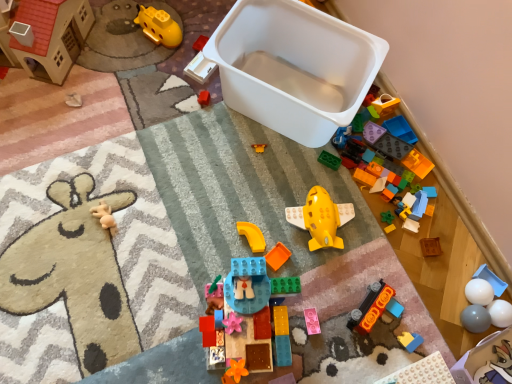
What is the approximate width of white plastic storage box at upper center, the 2th storage box in the right-to-left sequence?

The width of white plastic storage box at upper center, the 2th storage box in the right-to-left sequence, is 31.25 centimeters.

I want to click on white plastic storage box at upper center, the 1th storage box when ordered from left to right, so click(294, 66).

In order to face matte green block at center, the 6th toy in the right-to-left sequence, should I rotate leftwards or rightwards?

It's best to rotate right around 17.815 degrees.

This screenshot has width=512, height=384. What do you see at coordinates (159, 26) in the screenshot? I see `yellow plastic submarine at upper left, which appears as the third toy when viewed from the left` at bounding box center [159, 26].

What do you see at coordinates (104, 216) in the screenshot? This screenshot has width=512, height=384. I see `beige rubber bear at left, which ranks as the 15th toy in right-to-left order` at bounding box center [104, 216].

Describe the element at coordinates (200, 68) in the screenshot. Image resolution: width=512 pixels, height=384 pixels. I see `white plastic tray at upper center, placed as the 13th toy when sorted from right to left` at that location.

This screenshot has width=512, height=384. Describe the element at coordinates (243, 337) in the screenshot. I see `translucent blue plastic building block at center, the 12th toy from the right` at that location.

Find the location of `white plastic storage box at upper center, marked as the second storage box in a bottom-to-top arrangement`. white plastic storage box at upper center, marked as the second storage box in a bottom-to-top arrangement is located at coordinates (294, 66).

Which object is further away from the camera taking this photo, cardboard house at upper left, the 1th toy positioned from the left, or white plastic storage box at upper center, the 2th storage box in the right-to-left sequence?

Positioned behind is white plastic storage box at upper center, the 2th storage box in the right-to-left sequence.

Which toy is the 6th one when counting from the left side of the white plastic storage box at upper center, marked as the second storage box in a bottom-to-top arrangement? Please provide its 2D coordinates.

[(52, 36)]

Is cardboard house at upper left, which is the sixteenth toy in right-to-left order, facing away from white plastic storage box at upper center, which appears as the first storage box when viewed from the top?

No, cardboard house at upper left, which is the sixteenth toy in right-to-left order, is not facing away from white plastic storage box at upper center, which appears as the first storage box when viewed from the top.

Which point is more forward, (81, 38) or (249, 77)?

Positioned in front is point (249, 77).

Is orange matte car at lower right, the 8th toy in the right-to-left sequence, situated inside beige rubber bear at left, placed as the 2th toy when sorted from left to right, or outside?

orange matte car at lower right, the 8th toy in the right-to-left sequence, is spatially situated outside beige rubber bear at left, placed as the 2th toy when sorted from left to right.

Is orange matte car at lower right, marked as the 9th toy in a left-to-right arrangement, further to the viewer compared to beige rubber bear at left, which ranks as the 15th toy in right-to-left order?

No, it is in front of beige rubber bear at left, which ranks as the 15th toy in right-to-left order.

Considering the relative sizes of orange matte car at lower right, marked as the 9th toy in a left-to-right arrangement, and beige rubber bear at left, placed as the 2th toy when sorted from left to right, in the image provided, is orange matte car at lower right, marked as the 9th toy in a left-to-right arrangement, smaller than beige rubber bear at left, placed as the 2th toy when sorted from left to right,?

No, orange matte car at lower right, marked as the 9th toy in a left-to-right arrangement, is not smaller than beige rubber bear at left, placed as the 2th toy when sorted from left to right.

From the image's perspective, is orange matte car at lower right, the 8th toy in the right-to-left sequence, over beige rubber bear at left, placed as the 2th toy when sorted from left to right?

No, from the image's perspective, orange matte car at lower right, the 8th toy in the right-to-left sequence, is not above beige rubber bear at left, placed as the 2th toy when sorted from left to right.

From the image's perspective, is pearl white plastic plate at lower right, arranged as the fourth toy when viewed from the right, located above yellow plastic submarine at upper left, which ranks as the fourteenth toy in right-to-left order?

Actually, pearl white plastic plate at lower right, arranged as the fourth toy when viewed from the right, appears below yellow plastic submarine at upper left, which ranks as the fourteenth toy in right-to-left order, in the image.

Measure the distance between pearl white plastic plate at lower right, arranged as the fourth toy when viewed from the right, and yellow plastic submarine at upper left, which appears as the third toy when viewed from the left.

pearl white plastic plate at lower right, arranged as the fourth toy when viewed from the right, is 1.17 meters away from yellow plastic submarine at upper left, which appears as the third toy when viewed from the left.

Which of these two, pearl white plastic plate at lower right, which is counted as the 13th toy, starting from the left, or yellow plastic submarine at upper left, which appears as the third toy when viewed from the left, is bigger?

With larger size is pearl white plastic plate at lower right, which is counted as the 13th toy, starting from the left.

In the scene shown: Which of these two, orange matte car at lower right, the 8th toy in the right-to-left sequence, or white glossy ball at lower right, the fifteenth toy in the left-to-right sequence, is smaller?

white glossy ball at lower right, the fifteenth toy in the left-to-right sequence.

Is orange matte car at lower right, marked as the 9th toy in a left-to-right arrangement, located outside white glossy ball at lower right, the fifteenth toy in the left-to-right sequence?

Indeed, orange matte car at lower right, marked as the 9th toy in a left-to-right arrangement, is completely outside white glossy ball at lower right, the fifteenth toy in the left-to-right sequence.

What's the angular difference between orange matte car at lower right, marked as the 9th toy in a left-to-right arrangement, and white glossy ball at lower right, which ranks as the second toy in right-to-left order,'s facing directions?

There is a 24.2-degree angle between the facing directions of orange matte car at lower right, marked as the 9th toy in a left-to-right arrangement, and white glossy ball at lower right, which ranks as the second toy in right-to-left order.

Is orange matte car at lower right, the 8th toy in the right-to-left sequence, far from white glossy ball at lower right, which ranks as the second toy in right-to-left order?

orange matte car at lower right, the 8th toy in the right-to-left sequence, is near white glossy ball at lower right, which ranks as the second toy in right-to-left order, not far away.

From a real-world perspective, who is located higher, beige rubber bear at left, placed as the 2th toy when sorted from left to right, or white plastic tray at upper center, placed as the 13th toy when sorted from right to left?

From a 3D spatial view, beige rubber bear at left, placed as the 2th toy when sorted from left to right, is above.

Looking at this image, is beige rubber bear at left, placed as the 2th toy when sorted from left to right, located outside white plastic tray at upper center, acting as the fourth toy starting from the left?

Yes, beige rubber bear at left, placed as the 2th toy when sorted from left to right, is located beyond the bounds of white plastic tray at upper center, acting as the fourth toy starting from the left.

In the scene shown: Is beige rubber bear at left, which ranks as the 15th toy in right-to-left order, facing away from white plastic tray at upper center, placed as the 13th toy when sorted from right to left?

Yes.

Identify the location of the 7th toy in front of the white plastic tray at upper center, acting as the fourth toy starting from the left, counting from the anchor's position. (104, 216).

Between point (482, 314) and point (412, 333), which one is positioned in front?

Point (482, 314)

Does white glossy ball at lower right, acting as the 1th toy starting from the right, have a smaller size compared to matte plastic toy at lower right, which is counted as the 12th toy, starting from the left?

No.

Would you consider white glossy ball at lower right, acting as the 1th toy starting from the right, to be distant from matte plastic toy at lower right, which is counted as the 12th toy, starting from the left?

white glossy ball at lower right, acting as the 1th toy starting from the right, is actually quite close to matte plastic toy at lower right, which is counted as the 12th toy, starting from the left.

Considering the positions of objects white glossy ball at lower right, acting as the 16th toy starting from the left, and matte plastic toy at lower right, the 5th toy viewed from the right, in the image provided, who is more to the left, white glossy ball at lower right, acting as the 16th toy starting from the left, or matte plastic toy at lower right, the 5th toy viewed from the right,?

From the viewer's perspective, matte plastic toy at lower right, the 5th toy viewed from the right, appears more on the left side.

From the image's perspective, is beige rubber bear at left, which ranks as the 15th toy in right-to-left order, located above or below matte plastic toy at lower right, which is counted as the 12th toy, starting from the left?

beige rubber bear at left, which ranks as the 15th toy in right-to-left order, is situated higher than matte plastic toy at lower right, which is counted as the 12th toy, starting from the left, in the image.

Consider the image. Can you confirm if beige rubber bear at left, which ranks as the 15th toy in right-to-left order, is positioned to the left of matte plastic toy at lower right, which is counted as the 12th toy, starting from the left?

Yes, beige rubber bear at left, which ranks as the 15th toy in right-to-left order, is to the left of matte plastic toy at lower right, which is counted as the 12th toy, starting from the left.

Which of these two, beige rubber bear at left, placed as the 2th toy when sorted from left to right, or matte plastic toy at lower right, the 5th toy viewed from the right, stands shorter?

With less height is matte plastic toy at lower right, the 5th toy viewed from the right.

Is beige rubber bear at left, placed as the 2th toy when sorted from left to right, oriented towards matte plastic toy at lower right, the 5th toy viewed from the right?

No, beige rubber bear at left, placed as the 2th toy when sorted from left to right, is not aimed at matte plastic toy at lower right, the 5th toy viewed from the right.

The image size is (512, 384). Find the location of `toy that is the 1st one above the white plastic storage box at upper center, marked as the second storage box in a bottom-to-top arrangement (from a real-world perspective)`. toy that is the 1st one above the white plastic storage box at upper center, marked as the second storage box in a bottom-to-top arrangement (from a real-world perspective) is located at coordinates (52, 36).

This screenshot has width=512, height=384. Identify the location of the 5th toy in front of the beige rubber bear at left, placed as the 2th toy when sorted from left to right. (371, 307).

From the image, which object appears to be nearer to pearl white plastic plate at lower right, which is counted as the 13th toy, starting from the left, translucent blue plastic building block at center, the 12th toy from the right, or white glossy ball at lower right, the fifteenth toy in the left-to-right sequence?

white glossy ball at lower right, the fifteenth toy in the left-to-right sequence, is positioned closer to the anchor pearl white plastic plate at lower right, which is counted as the 13th toy, starting from the left.

Estimate the real-world distances between objects in this image. Which object is further from orange matte block at center, acting as the 6th toy starting from the left, matte green block at center, which ranks as the 11th toy in left-to-right order, or pearl white plastic plate at lower right, arranged as the fourth toy when viewed from the right?

Among the two, pearl white plastic plate at lower right, arranged as the fourth toy when viewed from the right, is located further to orange matte block at center, acting as the 6th toy starting from the left.

Considering their positions, is translucent blue plastic building block at center, the fifth toy viewed from the left, positioned closer to matte green block at center, the 6th toy in the right-to-left sequence, than wooden block at center, which is the third toy from right to left?

The object closer to matte green block at center, the 6th toy in the right-to-left sequence, is wooden block at center, which is the third toy from right to left.

Considering their positions, is cardboard house at upper left, the 1th toy positioned from the left, positioned closer to white plastic storage box at lower right, which is the 1th storage box in bottom-to-top order, than pearl white plastic plate at lower right, arranged as the fourth toy when viewed from the right?

→ pearl white plastic plate at lower right, arranged as the fourth toy when viewed from the right.

Looking at the image, which one is located further to pink matte block at center, the 7th toy from the left, wooden block at center, arranged as the fourteenth toy when viewed from the left, or white glossy ball at lower right, which ranks as the second toy in right-to-left order?

white glossy ball at lower right, which ranks as the second toy in right-to-left order, is positioned further to the anchor pink matte block at center, the 7th toy from the left.

Based on their spatial positions, is white plastic storage box at lower right, placed as the second storage box when sorted from left to right, or yellow matte airplane at center, the ninth toy from the right, closer to pink matte block at center, the tenth toy positioned from the right?

yellow matte airplane at center, the ninth toy from the right, is closer to pink matte block at center, the tenth toy positioned from the right.

Estimate the real-world distances between objects in this image. Which object is closer to green matte block at center, positioned as the 10th toy in left-to-right order, matte green block at center, the 6th toy in the right-to-left sequence, or translucent blue plastic building block at center, the fifth toy viewed from the left?

The object closer to green matte block at center, positioned as the 10th toy in left-to-right order, is matte green block at center, the 6th toy in the right-to-left sequence.

Considering their positions, is wooden block at center, which is the third toy from right to left, positioned further to white plastic storage box at upper center, the 2th storage box in the right-to-left sequence, than beige rubber bear at left, which ranks as the 15th toy in right-to-left order?

beige rubber bear at left, which ranks as the 15th toy in right-to-left order.

Locate an element on the screen. storage box located between yellow plastic submarine at upper left, which appears as the third toy when viewed from the left, and wooden block at center, which is the third toy from right to left, in the left-right direction is located at coordinates (294, 66).

Identify the location of storage box situated between cardboard house at upper left, which is the sixteenth toy in right-to-left order, and matte plastic toy at lower right, the 5th toy viewed from the right, from left to right. (294, 66).

Where is `storage box between yellow plastic submarine at upper left, which appears as the third toy when viewed from the left, and matte green block at center, the 6th toy in the right-to-left sequence, from left to right`? The image size is (512, 384). storage box between yellow plastic submarine at upper left, which appears as the third toy when viewed from the left, and matte green block at center, the 6th toy in the right-to-left sequence, from left to right is located at coordinates (294, 66).

I want to click on storage box between yellow plastic submarine at upper left, which ranks as the fourteenth toy in right-to-left order, and yellow matte airplane at center, the ninth toy from the right, in the vertical direction, so click(x=294, y=66).